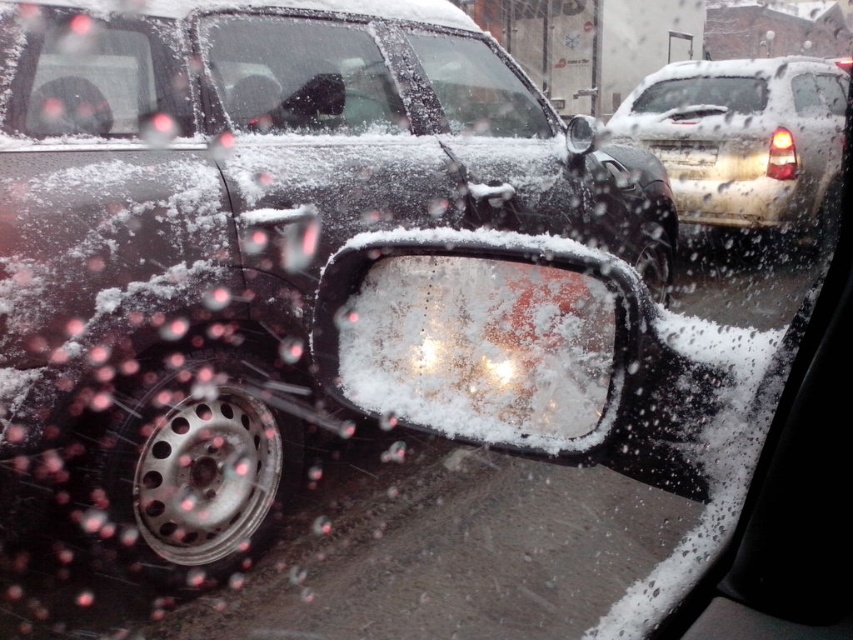
Question: Estimate the real-world distances between objects in this image. Which object is closer to the white glossy pickup truck at right?

Choices:
 (A) sleek black car at center
 (B) clear glass windshield at center
 (C) white plastic license plate at upper right
 (D) clear glass window at upper left

Answer: (C)

Question: Is clear glass windshield at center thinner than clear glass car window at upper center?

Choices:
 (A) yes
 (B) no

Answer: (A)

Question: Is frosted glass side mirror at center to the left of clear glass window at upper right from the viewer's perspective?

Choices:
 (A) yes
 (B) no

Answer: (A)

Question: Estimate the real-world distances between objects in this image. Which object is closer to the clear glass window at upper left?

Choices:
 (A) clear glass window at center
 (B) clear glass window at upper right
 (C) clear glass windshield at center

Answer: (A)

Question: Which point appears farthest from the camera in this image?

Choices:
 (A) (820, 109)
 (B) (479, 96)
 (C) (668, 152)
 (D) (668, 106)

Answer: (D)

Question: Is sleek black car at center wider than frosted glass side mirror at center?

Choices:
 (A) no
 (B) yes

Answer: (B)